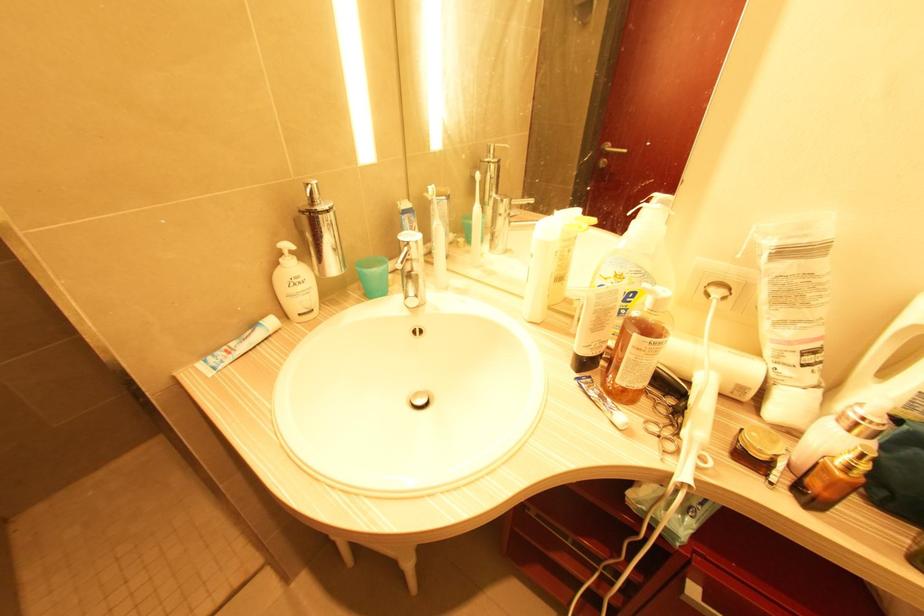
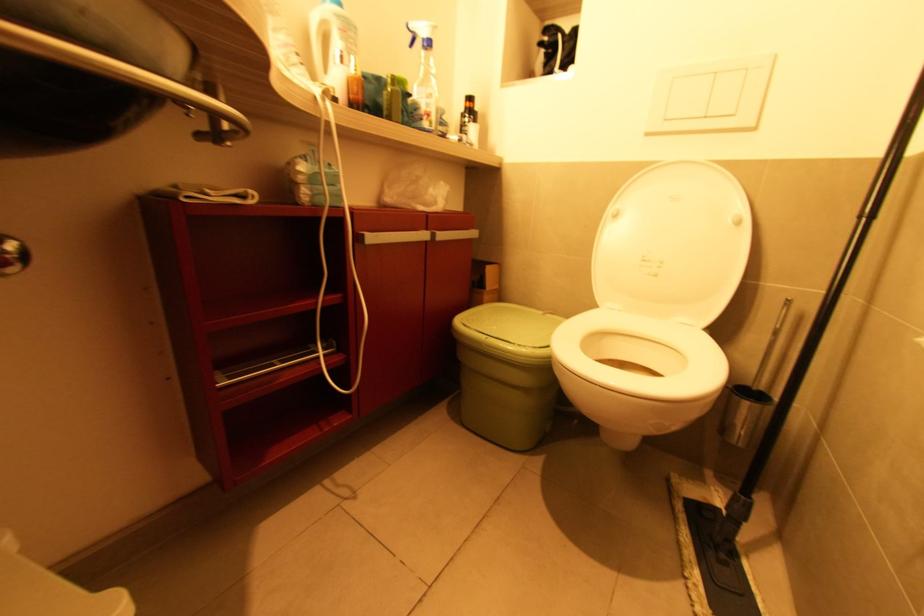
The images are taken continuously from a first-person perspective. In which direction is your viewpoint rotating?

The rotation direction of the camera is right-down.